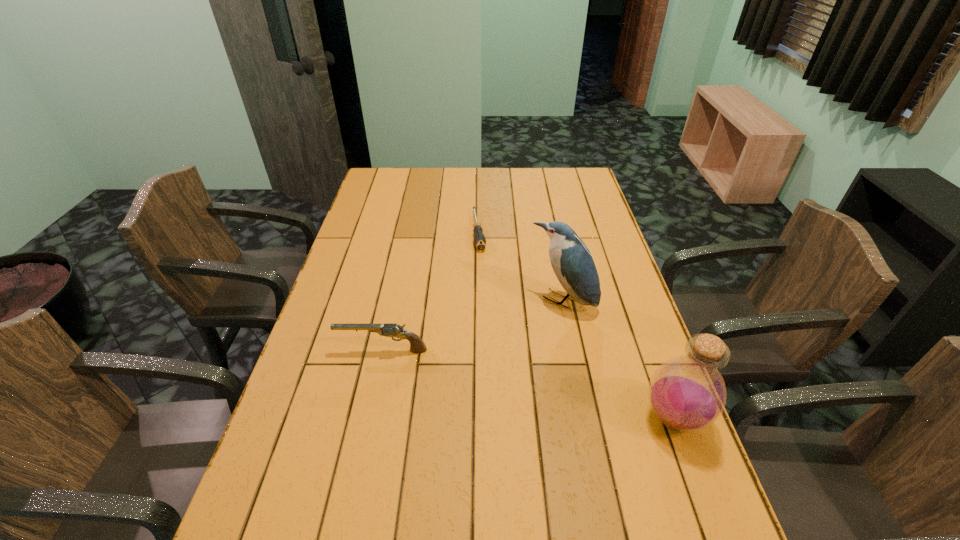
What are the coordinates of `free spot on the desktop that is between the gun and the rightmost object and is positioned at the tip of the bird's beak` in the screenshot? It's located at (502, 378).

You are a GUI agent. You are given a task and a screenshot of the screen. Output one action in this format:
    pyautogui.click(x=<x>, y=<y>)
    Task: Click on the vacant spot on the desktop that is between the gun and the bottle and is positioned at the tip of the shortest object
    The height and width of the screenshot is (540, 960).
    Given the screenshot: What is the action you would take?
    click(507, 379)